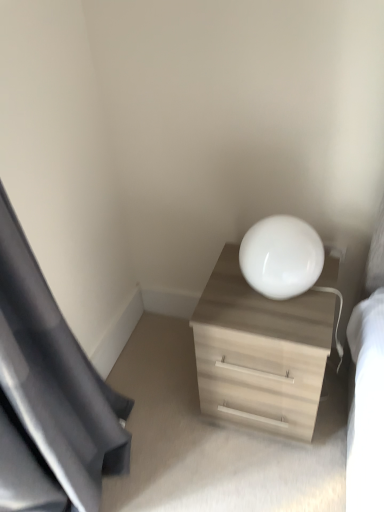
Where is `free region on the left part of light wood dresser at center`? free region on the left part of light wood dresser at center is located at coordinates (167, 401).